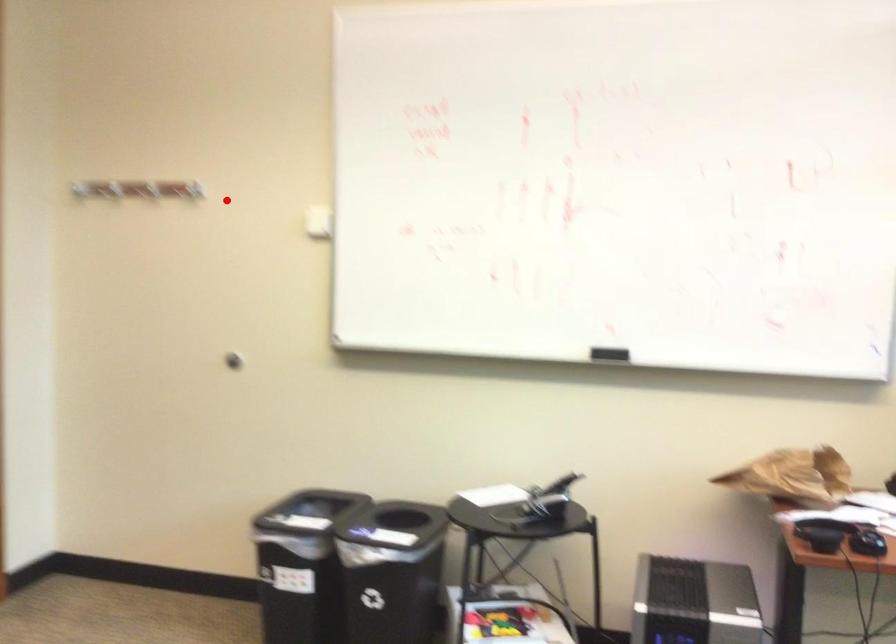
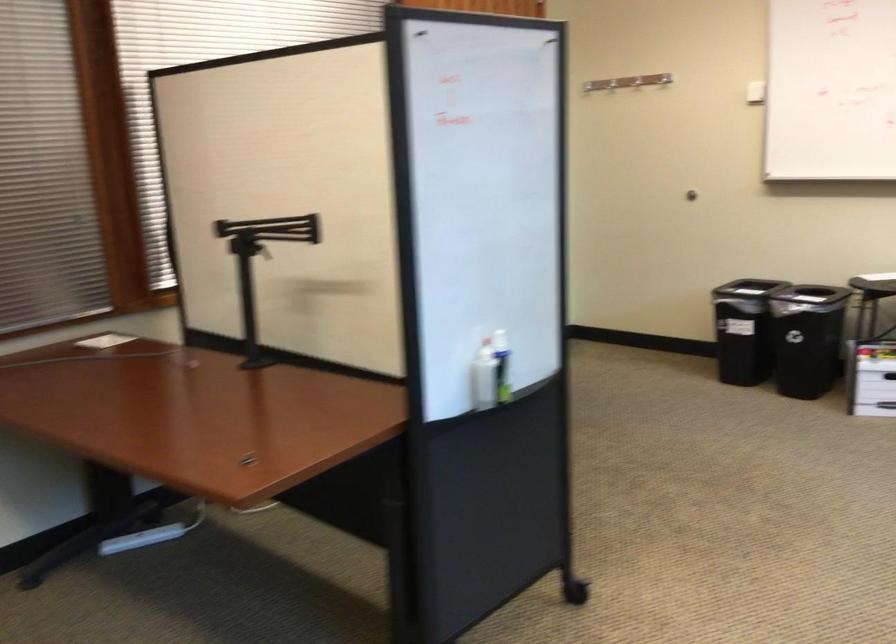
Locate, in the second image, the point that corresponds to the highlighted location in the first image.

(610, 84)